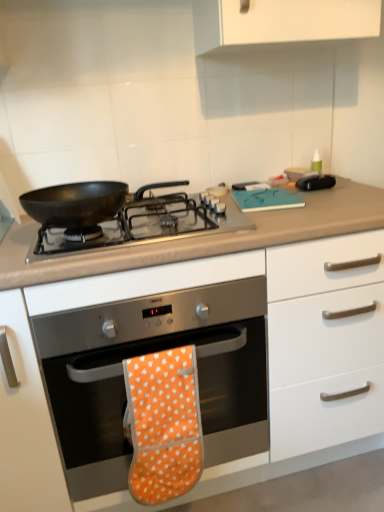
What is the approximate width of black matte pan at center?

It is 50.33 centimeters.

Identify the location of black matte pan at center. Image resolution: width=384 pixels, height=512 pixels. (144, 225).

Find the location of a particular element. Image resolution: width=384 pixels, height=512 pixels. orange fabric oven mitt at center is located at coordinates (164, 424).

Measure the distance between orange fabric oven mitt at center and camera.

A distance of 1.01 meters exists between orange fabric oven mitt at center and camera.

Locate an element on the screen. The width and height of the screenshot is (384, 512). white matte cabinet at center is located at coordinates (202, 327).

From a real-world perspective, is black matte pan at center physically located above or below matte black pan at center?

From a real-world perspective, black matte pan at center is physically below matte black pan at center.

Is black matte pan at center wider or thinner than matte black pan at center?

Considering their sizes, black matte pan at center looks broader than matte black pan at center.

Is point (131, 227) positioned behind point (71, 208)?

That is True.

How many degrees apart are the facing directions of black matte pan at center and matte black pan at center?

black matte pan at center and matte black pan at center are facing 0.00202 degrees away from each other.

Does orange fabric oven mitt at center have a smaller size compared to black matte pan at center?

Actually, orange fabric oven mitt at center might be larger than black matte pan at center.

Is point (231, 370) closer to camera compared to point (191, 195)?

Yes, it is.

Where is `gas stove lying above the orange fabric oven mitt at center (from the image's perspective)`? This screenshot has height=512, width=384. gas stove lying above the orange fabric oven mitt at center (from the image's perspective) is located at coordinates (144, 225).

From a real-world perspective, is orange fabric oven mitt at center physically above black matte pan at center?

No, from a real-world perspective, orange fabric oven mitt at center is not on top of black matte pan at center.

Is white matte cabinet at center facing towards orange fabric oven mitt at center?

Yes, white matte cabinet at center is facing orange fabric oven mitt at center.

Based on their positions, is white matte cabinet at center located to the left or right of orange fabric oven mitt at center?

From the image, it's evident that white matte cabinet at center is to the right of orange fabric oven mitt at center.

From the image's perspective, relative to orange fabric oven mitt at center, is white matte cabinet at center above or below?

white matte cabinet at center is situated higher than orange fabric oven mitt at center in the image.

Is white matte cabinet at center surrounding orange fabric oven mitt at center?

Yes, orange fabric oven mitt at center is surrounded by white matte cabinet at center.

Considering the relative sizes of matte black pan at center and orange fabric oven mitt at center in the image provided, is matte black pan at center thinner than orange fabric oven mitt at center?

Yes, matte black pan at center is thinner than orange fabric oven mitt at center.

Would you say matte black pan at center is a long distance from orange fabric oven mitt at center?

No, matte black pan at center is in close proximity to orange fabric oven mitt at center.

Is orange fabric oven mitt at center completely or partially inside matte black pan at center?

Definitely not — orange fabric oven mitt at center is not inside matte black pan at center.

Is the depth of matte black pan at center less than that of orange fabric oven mitt at center?

No, it is not.

Can you confirm if black matte pan at center is taller than orange fabric oven mitt at center?

No, black matte pan at center is not taller than orange fabric oven mitt at center.

Between black matte pan at center and orange fabric oven mitt at center, which one has larger size?

Bigger between the two is orange fabric oven mitt at center.

Is black matte pan at center completely or partially outside of orange fabric oven mitt at center?

black matte pan at center lies outside orange fabric oven mitt at center's area.

Based on the photo, from the image's perspective, which one is positioned higher, orange fabric oven mitt at center or white matte cabinet at center?

white matte cabinet at center appears higher in the image.

This screenshot has width=384, height=512. In order to click on oven located underneath the white matte cabinet at center (from a real-world perspective) in this screenshot , I will do `click(151, 352)`.

Is there a large distance between orange fabric oven mitt at center and white matte cabinet at center?

Actually, orange fabric oven mitt at center and white matte cabinet at center are a little close together.

Which of these two, orange fabric oven mitt at center or white matte cabinet at center, stands shorter?

orange fabric oven mitt at center.

How many degrees apart are the facing directions of orange fabric oven mitt at center and orange fabric oven mitt at center?

The facing directions of orange fabric oven mitt at center and orange fabric oven mitt at center are 0.00423 degrees apart.

Are orange fabric oven mitt at center and orange fabric oven mitt at center located far from each other?

No.

From a real-world perspective, is orange fabric oven mitt at center located higher than orange fabric oven mitt at center?

Incorrect, from a real-world perspective, orange fabric oven mitt at center is lower than orange fabric oven mitt at center.

Based on the photo, considering the relative positions of orange fabric oven mitt at center and orange fabric oven mitt at center in the image provided, is orange fabric oven mitt at center to the right of orange fabric oven mitt at center from the viewer's perspective?

Yes, orange fabric oven mitt at center is to the right of orange fabric oven mitt at center.

I want to click on kitchen appliance on the left of black matte pan at center, so pos(75,203).

You are a GUI agent. You are given a task and a screenshot of the screen. Output one action in this format:
    pyautogui.click(x=<x>, y=<y>)
    Task: Click on the oven that appears on the right of black matte pan at center
    The width and height of the screenshot is (384, 512).
    Given the screenshot: What is the action you would take?
    pyautogui.click(x=151, y=352)

Estimate the real-world distances between objects in this image. Which object is further from orange fabric oven mitt at center, white matte cabinet at center or black matte pan at center?

Based on the image, black matte pan at center appears to be further to orange fabric oven mitt at center.

Considering their positions, is black matte pan at center positioned closer to matte black pan at center than orange fabric oven mitt at center?

black matte pan at center lies closer to matte black pan at center than the other object.

In the scene shown: Considering their positions, is white matte cabinet at center positioned further to black matte pan at center than matte black pan at center?

white matte cabinet at center lies further to black matte pan at center than the other object.

When comparing their distances from white matte cabinet at center, does orange fabric oven mitt at center or orange fabric oven mitt at center seem further?

The object further to white matte cabinet at center is orange fabric oven mitt at center.

Based on their spatial positions, is matte black pan at center or orange fabric oven mitt at center further from black matte pan at center?

Based on the image, orange fabric oven mitt at center appears to be further to black matte pan at center.

Which object lies nearer to the anchor point black matte pan at center, white matte cabinet at center or orange fabric oven mitt at center?

white matte cabinet at center is closer to black matte pan at center.

Estimate the real-world distances between objects in this image. Which object is further from white matte cabinet at center, matte black pan at center or black matte pan at center?

The object further to white matte cabinet at center is matte black pan at center.

Considering their positions, is matte black pan at center positioned further to orange fabric oven mitt at center than white matte cabinet at center?

Among the two, matte black pan at center is located further to orange fabric oven mitt at center.

Find the location of a particular element. The height and width of the screenshot is (512, 384). cabinetry between matte black pan at center and orange fabric oven mitt at center in the vertical direction is located at coordinates (202, 327).

Identify the location of gas stove that lies between matte black pan at center and white matte cabinet at center from top to bottom. pyautogui.click(x=144, y=225).

Where is `gas stove between matte black pan at center and orange fabric oven mitt at center in the up-down direction`? gas stove between matte black pan at center and orange fabric oven mitt at center in the up-down direction is located at coordinates (144, 225).

The width and height of the screenshot is (384, 512). I want to click on gas stove between matte black pan at center and orange fabric oven mitt at center from top to bottom, so click(144, 225).